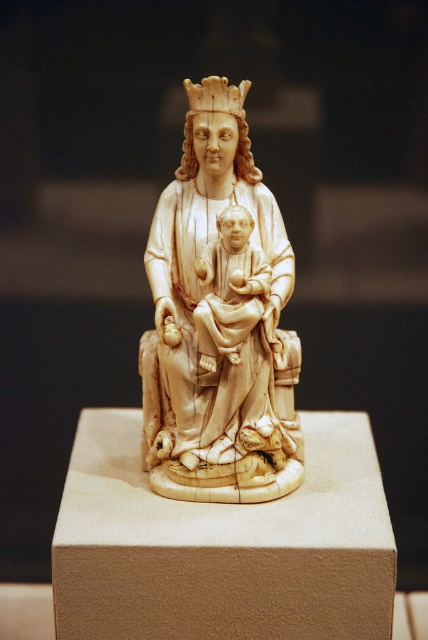
Question: Does ivory statue at center appear over ivory textured crown at upper center?

Choices:
 (A) yes
 (B) no

Answer: (B)

Question: Which of the following is the farthest from the observer?

Choices:
 (A) (231, 106)
 (B) (162, 436)

Answer: (B)

Question: Is ivory statue at center further to the viewer compared to ivory textured crown at upper center?

Choices:
 (A) yes
 (B) no

Answer: (B)

Question: Based on their relative distances, which object is farther from the ivory statue at center?

Choices:
 (A) ivory/carved wood baby at center
 (B) ivory textured crown at upper center

Answer: (B)

Question: Can you confirm if ivory statue at center is wider than ivory/carved wood baby at center?

Choices:
 (A) no
 (B) yes

Answer: (B)

Question: Which point appears closest to the camera in this image?

Choices:
 (A) (225, 108)
 (B) (171, 292)
 (C) (249, 330)

Answer: (C)